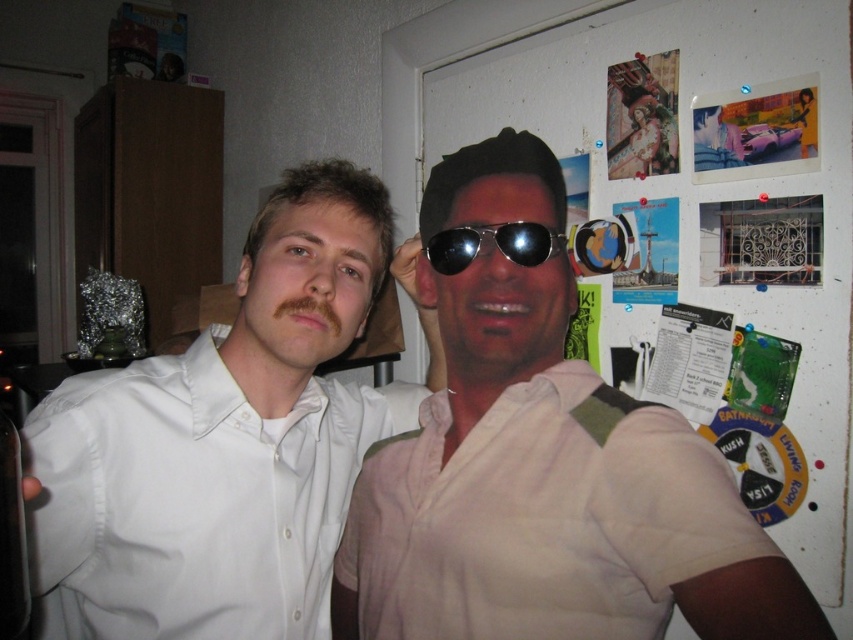
Question: Does light beige shirt at center appear on the right side of white smooth shirt at left?

Choices:
 (A) no
 (B) yes

Answer: (B)

Question: Which of these objects is positioned closest to the beige cotton shirt at center?

Choices:
 (A) white smooth shirt at left
 (B) light beige shirt at center

Answer: (B)

Question: Is light beige shirt at center to the right of metallic reflective sunglasses at center from the viewer's perspective?

Choices:
 (A) yes
 (B) no

Answer: (A)

Question: Does light beige shirt at center have a greater width compared to white smooth shirt at left?

Choices:
 (A) no
 (B) yes

Answer: (A)

Question: Estimate the real-world distances between objects in this image. Which object is farther from the metallic reflective sunglasses at center?

Choices:
 (A) beige cotton shirt at center
 (B) white smooth shirt at left

Answer: (B)

Question: Which point appears closest to the camera in this image?

Choices:
 (A) click(456, 172)
 (B) click(590, 608)

Answer: (B)